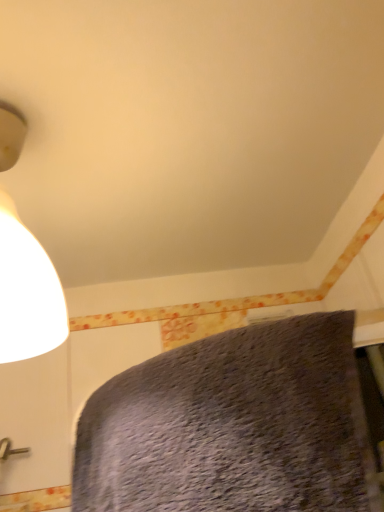
In order to face textured gray bed at lower center, should I rotate leftwards or rightwards?

Turn left approximately 2.101 degrees to face it.

Image resolution: width=384 pixels, height=512 pixels. What do you see at coordinates (235, 426) in the screenshot?
I see `textured gray bed at lower center` at bounding box center [235, 426].

You are a GUI agent. You are given a task and a screenshot of the screen. Output one action in this format:
    pyautogui.click(x=<x>, y=<y>)
    Task: Click on the textured gray bed at lower center
    The width and height of the screenshot is (384, 512).
    Given the screenshot: What is the action you would take?
    pyautogui.click(x=235, y=426)

What do you see at coordinates (27, 292) in the screenshot? The image size is (384, 512). I see `matte white lampshade at upper left` at bounding box center [27, 292].

Image resolution: width=384 pixels, height=512 pixels. I want to click on matte white lampshade at upper left, so click(x=27, y=292).

At what (x,y) coordinates should I click in order to perform the action: click on textured gray bed at lower center. Please return your answer as a coordinate pair (x, y). The height and width of the screenshot is (512, 384). Looking at the image, I should click on (235, 426).

Which is more to the right, textured gray bed at lower center or matte white lampshade at upper left?

textured gray bed at lower center.

Based on the photo, which is behind, textured gray bed at lower center or matte white lampshade at upper left?

matte white lampshade at upper left.

Between point (291, 323) and point (18, 340), which one is positioned in front?

The point (291, 323) is closer to the camera.

Consider the image. From the image's perspective, is textured gray bed at lower center on top of matte white lampshade at upper left?

No.

From a real-world perspective, is textured gray bed at lower center located higher than matte white lampshade at upper left?

Incorrect, from a real-world perspective, textured gray bed at lower center is lower than matte white lampshade at upper left.

Is textured gray bed at lower center wider than matte white lampshade at upper left?

No, textured gray bed at lower center is not wider than matte white lampshade at upper left.

From their relative heights in the image, would you say textured gray bed at lower center is taller or shorter than matte white lampshade at upper left?

textured gray bed at lower center is shorter than matte white lampshade at upper left.

Considering the sizes of objects textured gray bed at lower center and matte white lampshade at upper left in the image provided, who is smaller, textured gray bed at lower center or matte white lampshade at upper left?

Smaller between the two is matte white lampshade at upper left.

Would you say textured gray bed at lower center is outside matte white lampshade at upper left?

Yes.

Is textured gray bed at lower center positioned far away from matte white lampshade at upper left?

textured gray bed at lower center is near matte white lampshade at upper left, not far away.

Is matte white lampshade at upper left at the back of textured gray bed at lower center?

No, textured gray bed at lower center is not facing away from matte white lampshade at upper left.

This screenshot has width=384, height=512. Find the location of `lamp lying on the left of textured gray bed at lower center`. lamp lying on the left of textured gray bed at lower center is located at coordinates (27, 292).

Is matte white lampshade at upper left to the left of textured gray bed at lower center from the viewer's perspective?

Yes.

Is matte white lampshade at upper left closer to camera compared to textured gray bed at lower center?

No, it is not.

Which point is more distant from viewer, (x=6, y=236) or (x=275, y=329)?

The point (x=275, y=329) is farther from the camera.

From the image's perspective, which one is positioned higher, matte white lampshade at upper left or textured gray bed at lower center?

matte white lampshade at upper left, from the image's perspective.

From a real-world perspective, does matte white lampshade at upper left sit lower than textured gray bed at lower center?

Incorrect, from a real-world perspective, matte white lampshade at upper left is higher than textured gray bed at lower center.

Can you confirm if matte white lampshade at upper left is wider than textured gray bed at lower center?

Indeed, matte white lampshade at upper left has a greater width compared to textured gray bed at lower center.

Considering the relative sizes of matte white lampshade at upper left and textured gray bed at lower center in the image provided, is matte white lampshade at upper left taller than textured gray bed at lower center?

Yes, matte white lampshade at upper left is taller than textured gray bed at lower center.

Which of these two, matte white lampshade at upper left or textured gray bed at lower center, is smaller?

matte white lampshade at upper left is smaller.

Is textured gray bed at lower center surrounded by matte white lampshade at upper left?

Actually, textured gray bed at lower center is outside matte white lampshade at upper left.

Is matte white lampshade at upper left with textured gray bed at lower center?

matte white lampshade at upper left and textured gray bed at lower center are clearly separated.

Could you tell me if matte white lampshade at upper left is facing textured gray bed at lower center?

No, matte white lampshade at upper left is not facing towards textured gray bed at lower center.

How distant is matte white lampshade at upper left from textured gray bed at lower center?

A distance of 12.02 inches exists between matte white lampshade at upper left and textured gray bed at lower center.

Where is `lamp positioned vertically above the textured gray bed at lower center (from a real-world perspective)`? This screenshot has width=384, height=512. lamp positioned vertically above the textured gray bed at lower center (from a real-world perspective) is located at coordinates (27, 292).

Find the location of a particular element. lamp behind the textured gray bed at lower center is located at coordinates (27, 292).

Identify the location of bed on the right of matte white lampshade at upper left. The height and width of the screenshot is (512, 384). (235, 426).